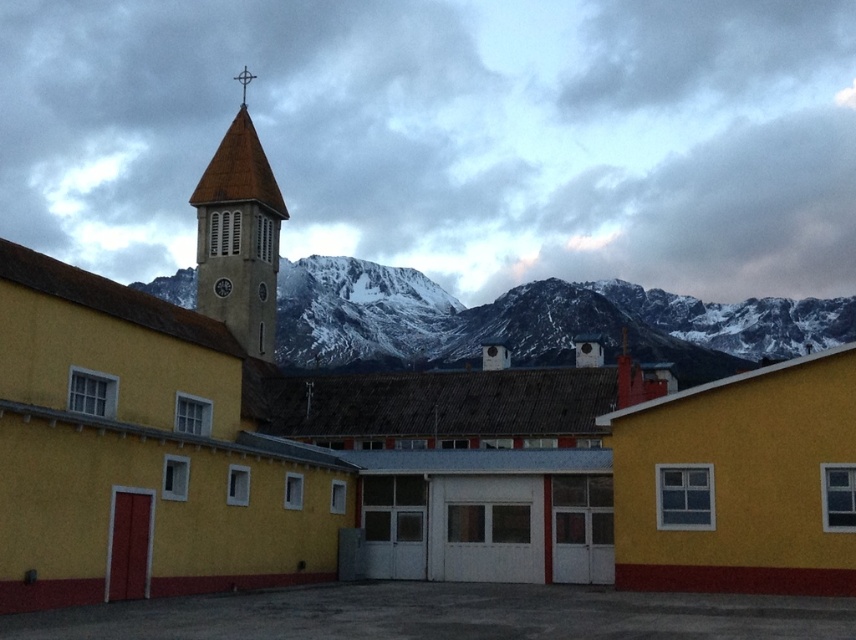
You are an architect analyzing the layout of this building. The snowy rock formation at upper center and brown tiled bell tower at upper left are both visible in the background. Which of these two landmarks is positioned to the right of the other?

The snowy rock formation at upper center is positioned to the right of the brown tiled bell tower at upper left.